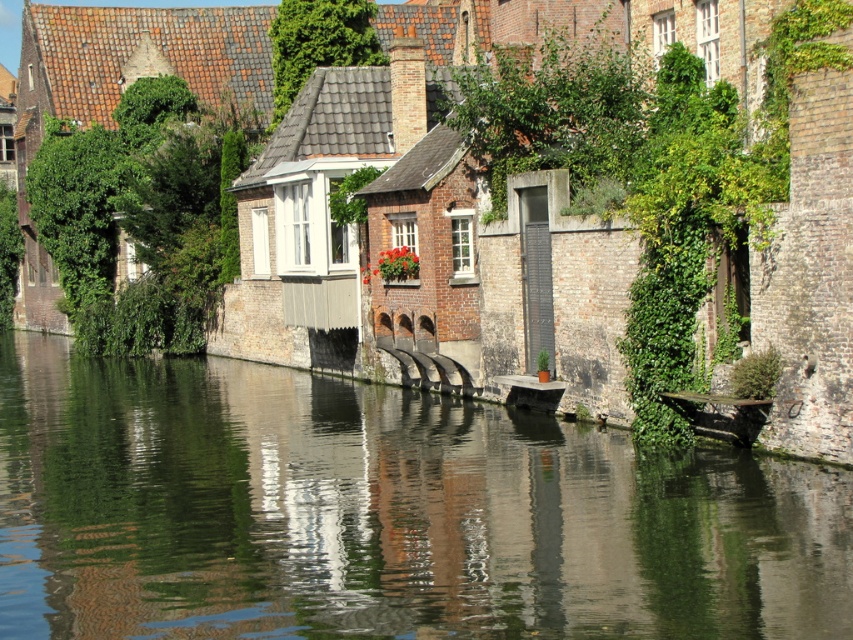
Is smooth concrete water at center below wooden boat at center?

Yes.

Is point (109, 362) closer to viewer compared to point (711, 401)?

That is False.

Which is in front, point (381, 506) or point (697, 396)?

Positioned in front is point (381, 506).

In order to click on smooth concrete water at center in this screenshot , I will do `click(383, 513)`.